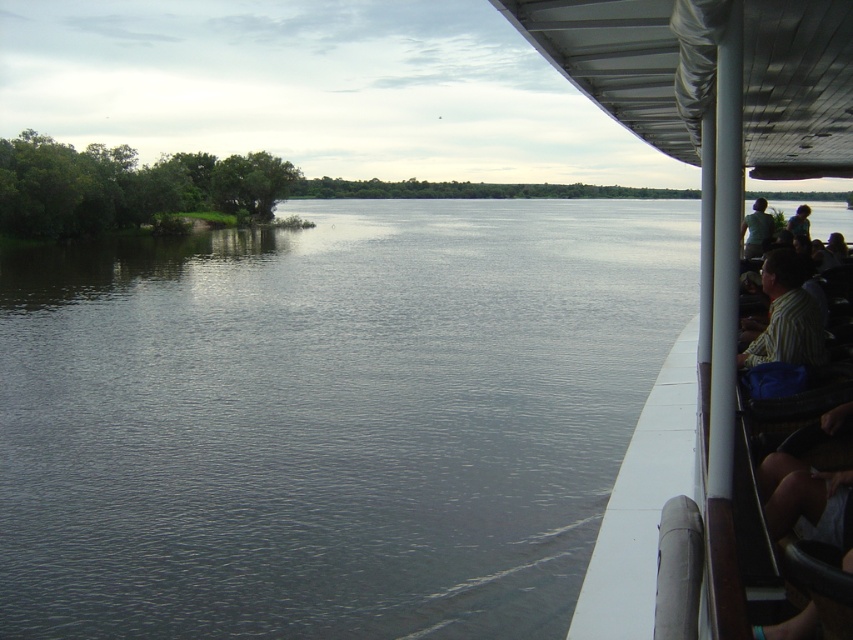
Based on the photo, you are standing on the deck of the boat and want to place a striped shirt at right on the white plastic boat at right. Given that the boat is 2 meters long and the shirt is 0.5 meters wide, will the shirt fit on the boat?

The white plastic boat at right is bigger than the striped shirt at right, so yes, the striped shirt at right will fit on the white plastic boat at right since the boat is larger in size.